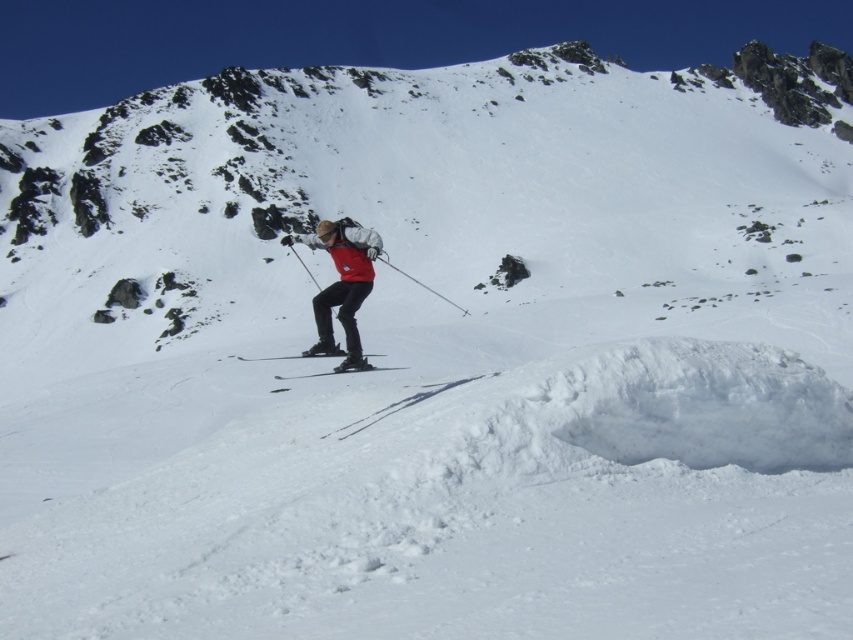
You are a photographer capturing the skier in the snow. You notice the matte black ski at center and the metallic silver ski pole at center. Which object is shorter in the image?

The matte black ski at center is shorter than the metallic silver ski pole at center.

You are a photographer trying to capture the skier in the image. You want to ensure both the matte black skis at center and the metallic silver ski pole at center are clearly visible in your shot. Which object should you focus on first if you want to capture the larger one in detail?

The metallic silver ski pole at center is larger than the matte black skis at center, so you should focus on the metallic silver ski pole at center first to capture it in detail.

You are a photographer capturing the skier in the scene. To ensure the matte black ski at center and the metallic silver ski pole at center are both clearly visible in your photo, which object should you focus on first?

The matte black ski at center is positioned under the metallic silver ski pole at center, so you should focus on the metallic silver ski pole at center first to ensure both are in clear view.